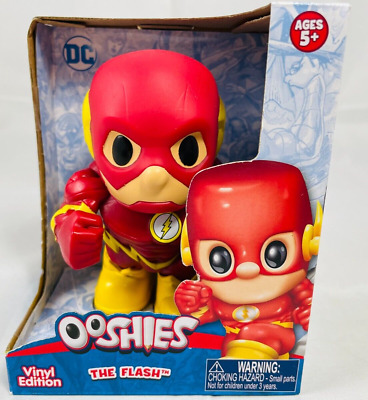
Where is `display box`? The width and height of the screenshot is (368, 400). display box is located at coordinates (195, 370).